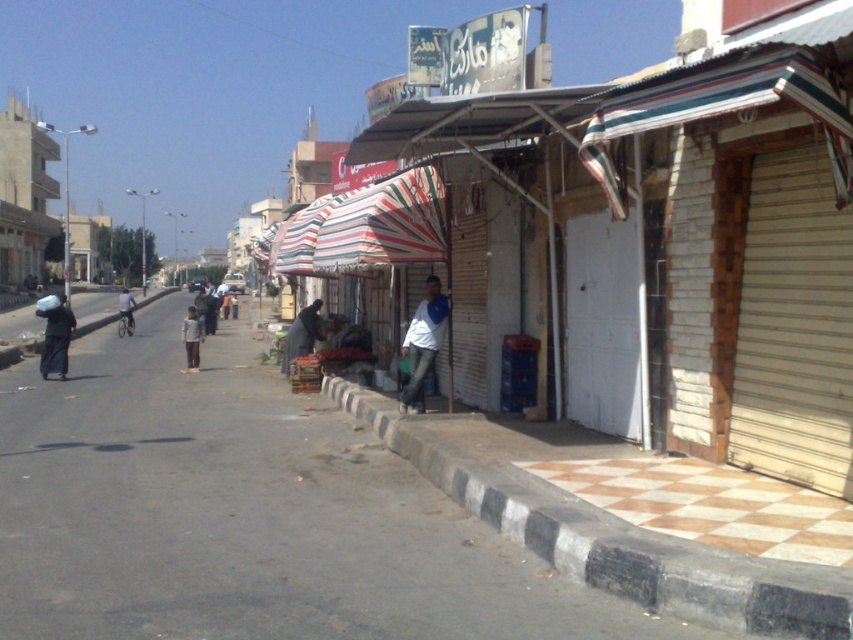
Question: Which object is the farthest from the dark blue jeans at center?

Choices:
 (A) white matte shirt at center
 (B) dark gray fabric at left
 (C) light blue fabric shirt at center

Answer: (A)

Question: Is white corrugated metal hut at center right wider than dark gray fabric at left?

Choices:
 (A) yes
 (B) no

Answer: (B)

Question: Which point is farther from the camera taking this photo?

Choices:
 (A) (131, 307)
 (B) (374, 234)

Answer: (A)

Question: Is light brown concrete building at left above white matte shirt at center?

Choices:
 (A) no
 (B) yes

Answer: (B)

Question: Can you confirm if dark gray fabric at left is wider than dark blue jeans at center?

Choices:
 (A) yes
 (B) no

Answer: (A)

Question: Among these points, which one is farthest from the camera?

Choices:
 (A) (196, 348)
 (B) (521, 484)
 (C) (51, 353)
 (D) (126, 305)

Answer: (D)